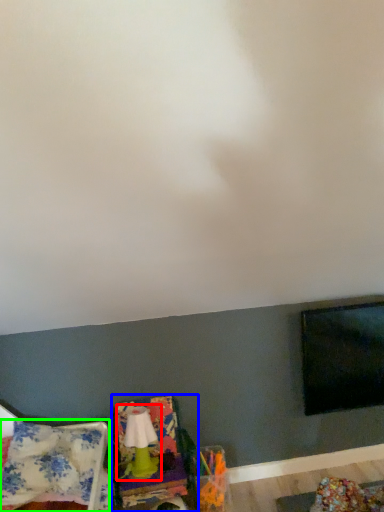
Question: Considering the real-world distances, which object is farthest from lamp (highlighted by a red box)? swivel chair (highlighted by a blue box) or blanket (highlighted by a green box)?

Choices:
 (A) swivel chair
 (B) blanket

Answer: (B)